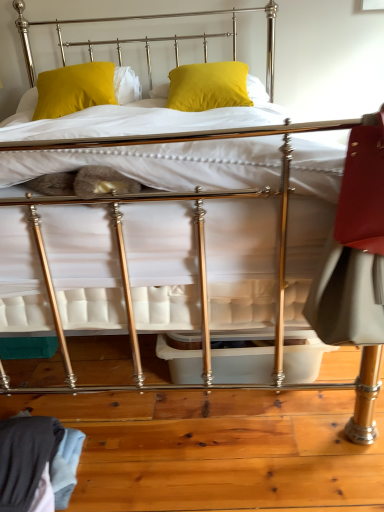
Question: Is yellow matte pillow at upper center, the second pillow viewed from the right, bigger or smaller than matte yellow pillow at center, the 2th pillow when ordered from left to right?

Choices:
 (A) small
 (B) big

Answer: (A)

Question: Considering the positions of point (74, 80) and point (195, 84), is point (74, 80) closer or farther from the camera than point (195, 84)?

Choices:
 (A) farther
 (B) closer

Answer: (A)

Question: Considering the positions of yellow matte pillow at upper center, which appears as the first pillow when viewed from the left, and matte yellow pillow at center, which is the 1th pillow from right to left, in the image, is yellow matte pillow at upper center, which appears as the first pillow when viewed from the left, taller or shorter than matte yellow pillow at center, which is the 1th pillow from right to left,?

Choices:
 (A) tall
 (B) short

Answer: (A)

Question: Is point (203, 95) positioned closer to the camera than point (67, 84)?

Choices:
 (A) farther
 (B) closer

Answer: (B)

Question: In terms of height, does matte yellow pillow at center, which is the 1th pillow from right to left, look taller or shorter compared to yellow matte pillow at upper center, the second pillow viewed from the right?

Choices:
 (A) short
 (B) tall

Answer: (A)

Question: From the image's perspective, is matte yellow pillow at center, the 2th pillow when ordered from left to right, positioned above or below yellow matte pillow at upper center, which appears as the first pillow when viewed from the left?

Choices:
 (A) above
 (B) below

Answer: (A)

Question: Visually, is matte yellow pillow at center, the 2th pillow when ordered from left to right, positioned to the left or to the right of yellow matte pillow at upper center, which appears as the first pillow when viewed from the left?

Choices:
 (A) right
 (B) left

Answer: (A)